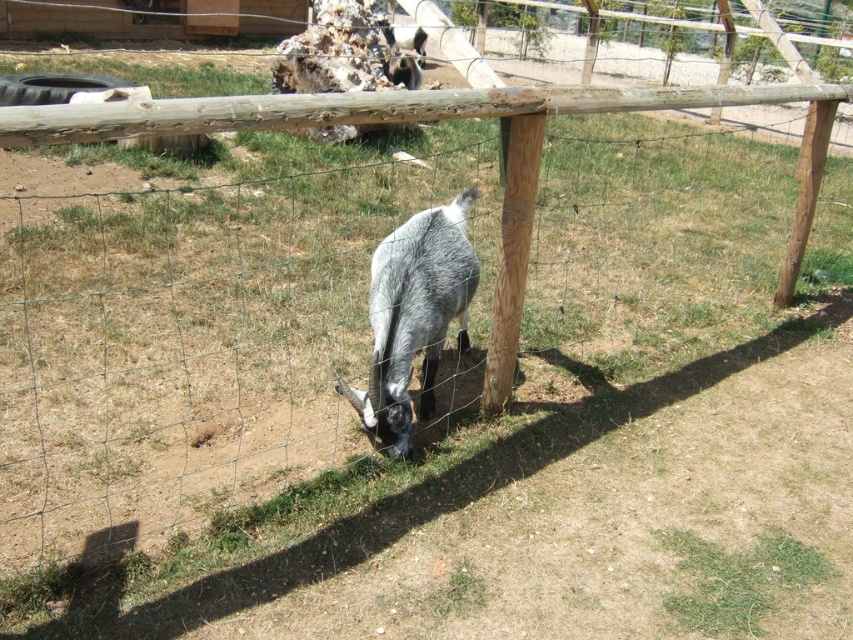
Question: Which of these objects is positioned closest to the brown rough wooden post at center?

Choices:
 (A) gray woolen goat at center
 (B) fuzzy gray goat at center

Answer: (A)

Question: Observing the image, what is the correct spatial positioning of gray woolen goat at center in reference to brown rough wooden post at center?

Choices:
 (A) below
 (B) above

Answer: (A)

Question: Can you confirm if gray woolen goat at center is wider than brown rough wooden post at center?

Choices:
 (A) yes
 (B) no

Answer: (A)

Question: Which point appears farthest from the camera in this image?

Choices:
 (A) (413, 68)
 (B) (380, 392)

Answer: (A)

Question: Which point is farther from the camera taking this photo?

Choices:
 (A) (416, 68)
 (B) (393, 260)

Answer: (A)

Question: Is brown rough wooden post at center closer to camera compared to fuzzy gray goat at center?

Choices:
 (A) no
 (B) yes

Answer: (B)